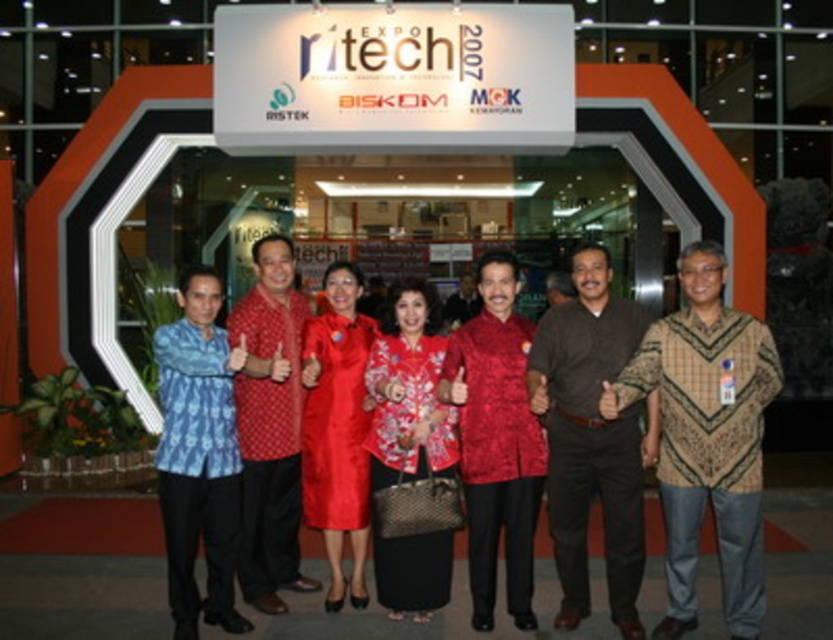
You are organizing a photo shoot and need to ensure that all participants are visible in the frame. Given that the camera has a maximum width capacity of 1.2 meters, and both the brown batik shirt at center and red batik shirt at center are within the frame, can both shirts fit within the camera frame simultaneously?

The brown batik shirt at center has a larger width than the red batik shirt at center. Since the camera can only accommodate up to 1.2 meters, both shirts can fit if their combined widths do not exceed the limit. However, without knowing the exact widths of each shirt, it is impossible to definitively confirm if they will both fit within the frame.

You are a photographer who needs to adjust the lighting between the brown batik shirt at center and the red batik shirt at center. Since the distance between them is 2.39 meters, will you need to use a reflector to ensure both shirts are equally lit?

The distance between the brown batik shirt at center and the red batik shirt at center is 2.39 meters. To ensure both shirts are equally lit, a reflector may be necessary depending on the lighting setup, but the description does not provide specific lighting conditions to confirm this requirement.

You are a photographer who needs to adjust the lighting for the person wearing the brown batik shirt at center and the silky red dress at center. Since the lighting is currently focused on the background, which of the two requires more immediate adjustment to ensure their faces are properly lit?

The brown batik shirt at center requires more immediate adjustment because it is closer to the viewer and its face needs proper lighting first before the silky red dress at center which is farther away.